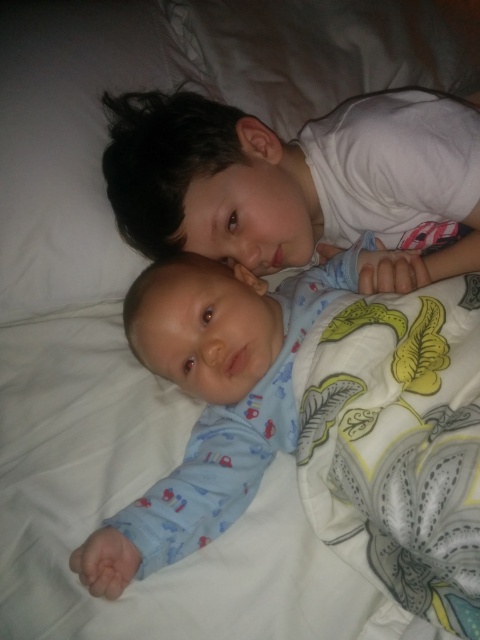
Question: Can you confirm if white smooth shirt at upper center is positioned to the left of blue cotton onesie at center?

Choices:
 (A) yes
 (B) no

Answer: (B)

Question: Can you confirm if white smooth shirt at upper center is smaller than blue cotton onesie at center?

Choices:
 (A) yes
 (B) no

Answer: (B)

Question: Which point is closer to the camera?

Choices:
 (A) (172, 122)
 (B) (264, 397)

Answer: (B)

Question: Among these points, which one is farthest from the camera?

Choices:
 (A) (195, 484)
 (B) (296, 182)

Answer: (B)

Question: Among these objects, which one is nearest to the camera?

Choices:
 (A) blue cotton onesie at center
 (B) white smooth shirt at upper center

Answer: (A)

Question: Is white smooth shirt at upper center above blue cotton onesie at center?

Choices:
 (A) no
 (B) yes

Answer: (B)